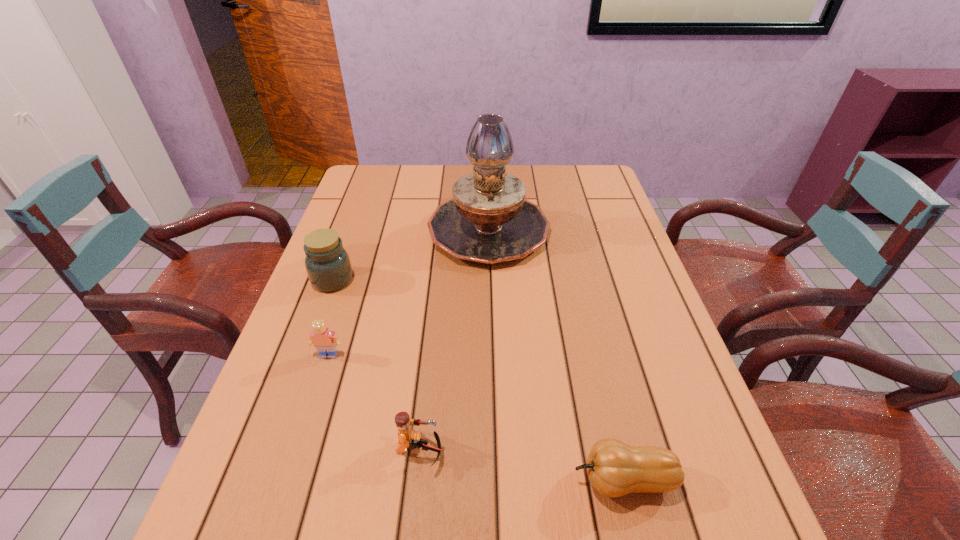
This screenshot has width=960, height=540. In order to click on free space at the far right corner of the desktop in this screenshot , I will do `click(605, 181)`.

You are a GUI agent. You are given a task and a screenshot of the screen. Output one action in this format:
    pyautogui.click(x=<x>, y=<y>)
    Task: Click on the vacant space in between the third nearest object and the gourd
    
    Given the screenshot: What is the action you would take?
    pyautogui.click(x=476, y=417)

Locate an element on the screen. free space between the tallest object and the gourd is located at coordinates (556, 354).

The width and height of the screenshot is (960, 540). In order to click on unoccupied area between the nearer Lego and the gourd in this screenshot , I will do `click(521, 465)`.

Image resolution: width=960 pixels, height=540 pixels. Find the location of `free space between the gourd and the left Lego`. free space between the gourd and the left Lego is located at coordinates (476, 417).

Locate an element on the screen. empty space between the jar and the left Lego is located at coordinates tap(330, 317).

The image size is (960, 540). I want to click on blank region between the right Lego and the gourd, so click(x=521, y=465).

Where is `free space between the farther Lego and the tallest object`? This screenshot has width=960, height=540. free space between the farther Lego and the tallest object is located at coordinates (409, 292).

Identify the location of unoccupied position between the tallest object and the jar. (411, 254).

Where is `free spot between the gourd and the nearer Lego`? The height and width of the screenshot is (540, 960). free spot between the gourd and the nearer Lego is located at coordinates (521, 465).